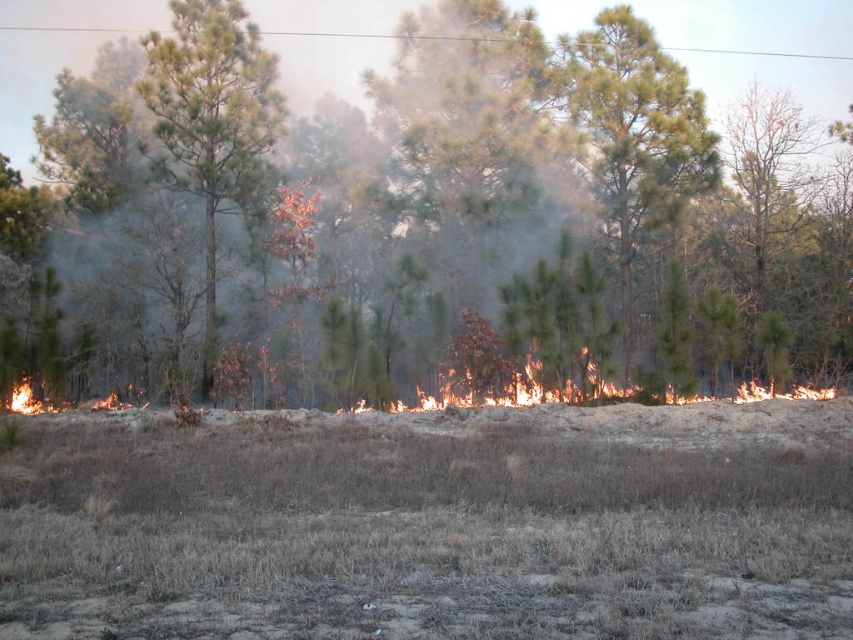
You are a firefighter trying to create a firebreak between the brown dry grass at lower center and the flames in the background. The firebreak needs to be at least 6 meters wide to be effective. Can the existing gap between them suffice?

The gap between the brown dry grass at lower center and the flames in the background is 6.16 meters, which meets the required width of 6 meters. Therefore, the existing gap can serve as an effective firebreak.